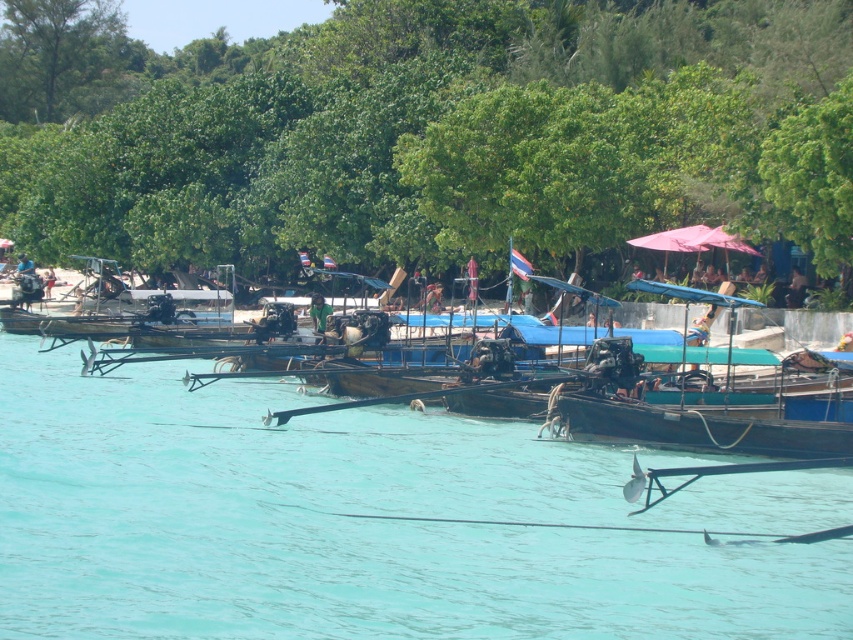
Question: Which of the following is the closest to the observer?

Choices:
 (A) (354, 611)
 (B) (795, 282)

Answer: (A)

Question: Where is green leafy trees at center located in relation to green fabric person at center in the image?

Choices:
 (A) right
 (B) left

Answer: (B)

Question: Which object appears farthest from the camera in this image?

Choices:
 (A) green leafy tree at upper right
 (B) dark blue fabric umbrella at center

Answer: (B)

Question: Can you confirm if pink fabric umbrella at upper center is positioned to the left of dark blue fabric umbrella at center?

Choices:
 (A) yes
 (B) no

Answer: (A)

Question: Which object is the farthest from the pink fabric umbrella at upper center?

Choices:
 (A) green fabric person at center
 (B) dark blue fabric umbrella at center
 (C) dark brown wooden boat at center

Answer: (C)

Question: Does green leafy tree at upper right have a greater width compared to green fabric person at center?

Choices:
 (A) no
 (B) yes

Answer: (A)